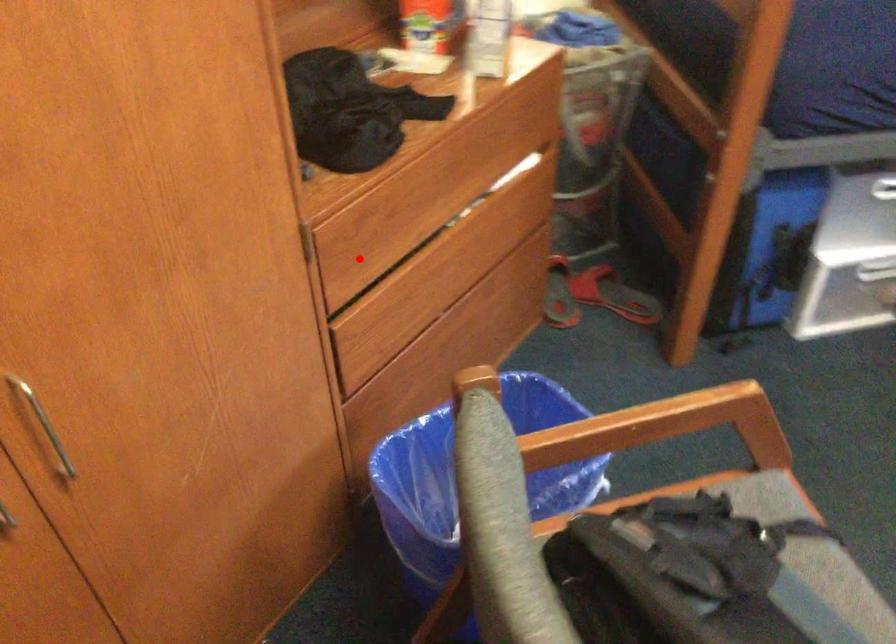
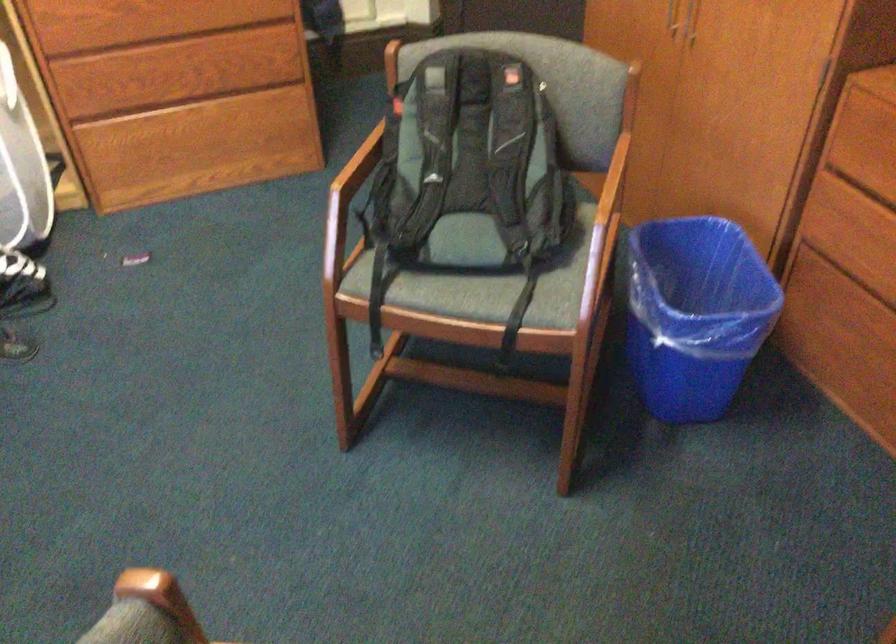
Question: I am providing you with two images of the same scene from different viewpoints. Image1 has a red point marked. In image2, the corresponding 3D location appears at what relative position? Reply with the corresponding letter.

Choices:
 (A) Closer
 (B) Farther

Answer: (B)